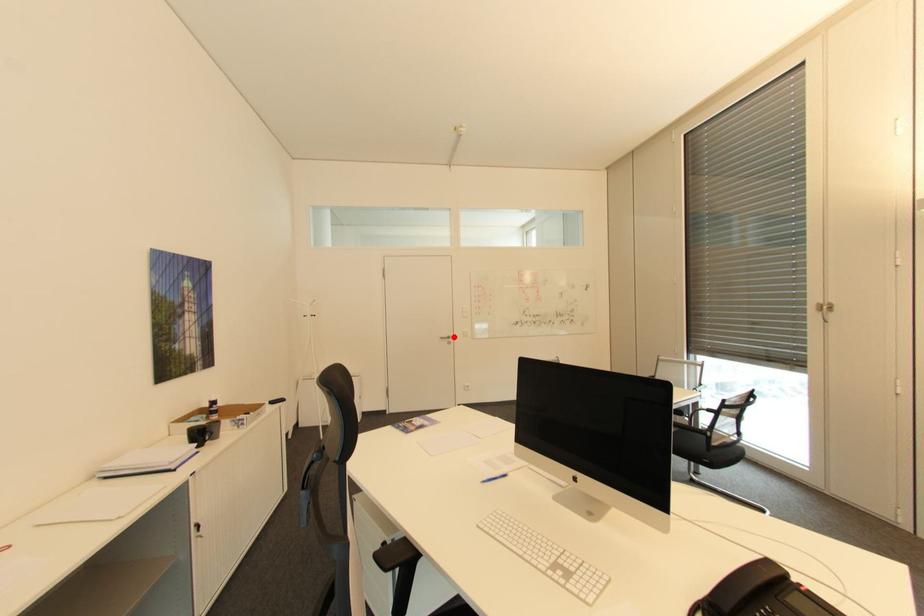
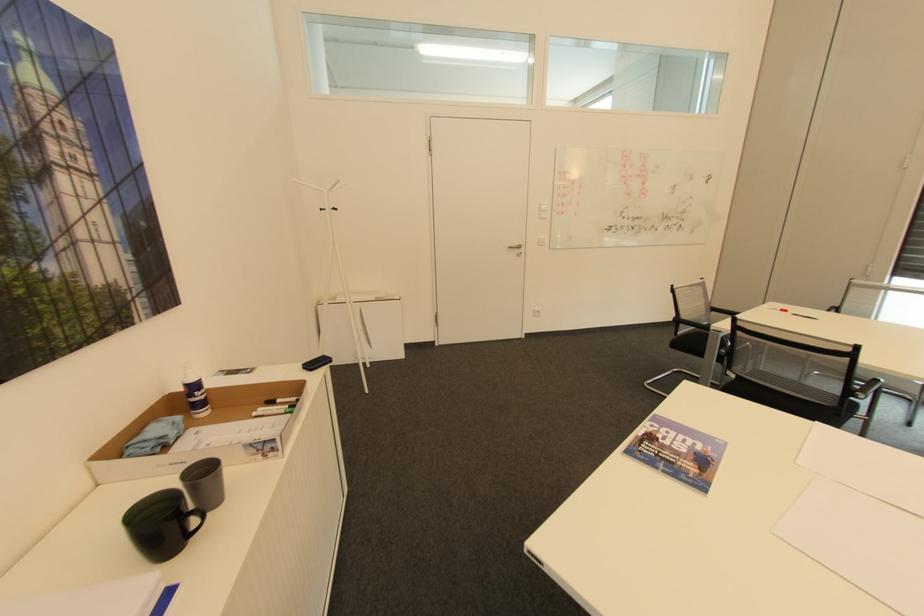
Question: I am providing you with two images of the same scene from different viewpoints. A red point is marked on the first image. Can you still see the location of the red point in image 2?

Choices:
 (A) Yes
 (B) No

Answer: (A)